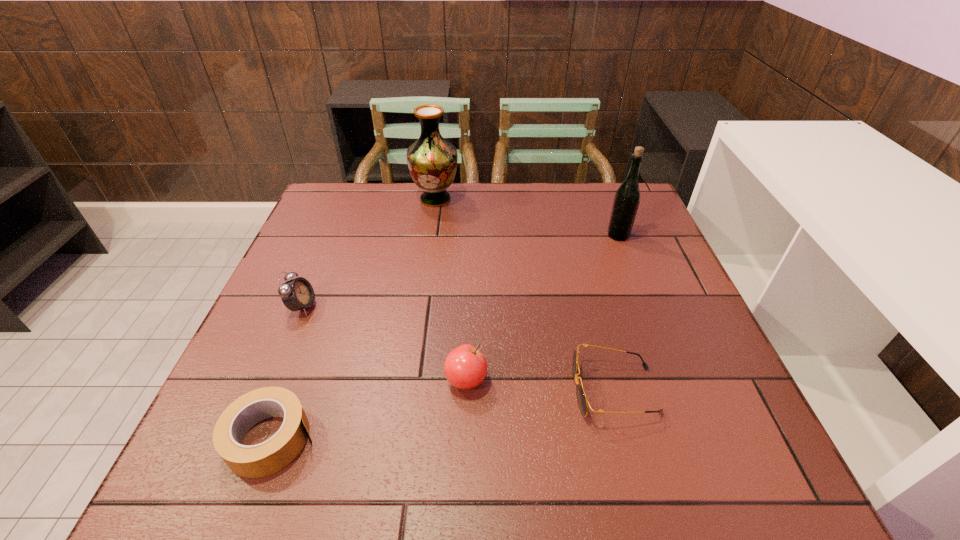
Image resolution: width=960 pixels, height=540 pixels. Identify the location of vacant space located on the face of the alarm clock. (397, 307).

Where is `free spot located on the left of the apple`? The width and height of the screenshot is (960, 540). free spot located on the left of the apple is located at coordinates (249, 380).

Where is `free region located at the edge of the duct tape`? This screenshot has width=960, height=540. free region located at the edge of the duct tape is located at coordinates (438, 438).

I want to click on vacant space located 0.060m on the front-facing side of the sunglasses, so point(542,390).

Find the location of a particular element. vacant space situated 0.180m on the front-facing side of the sunglasses is located at coordinates (480, 390).

Identify the location of free space located 0.100m on the front-facing side of the sunglasses. The height and width of the screenshot is (540, 960). (521, 390).

You are a GUI agent. You are given a task and a screenshot of the screen. Output one action in this format:
    pyautogui.click(x=<x>, y=<y>)
    Task: Click on the object that is at the far edge
    Image resolution: width=960 pixels, height=540 pixels.
    Given the screenshot: What is the action you would take?
    pyautogui.click(x=432, y=161)

Image resolution: width=960 pixels, height=540 pixels. In order to click on object present at the near edge in this screenshot , I will do `click(251, 461)`.

The height and width of the screenshot is (540, 960). I want to click on alarm clock that is at the left edge, so click(296, 294).

Locate an element on the screen. The height and width of the screenshot is (540, 960). duct tape at the left edge is located at coordinates (251, 461).